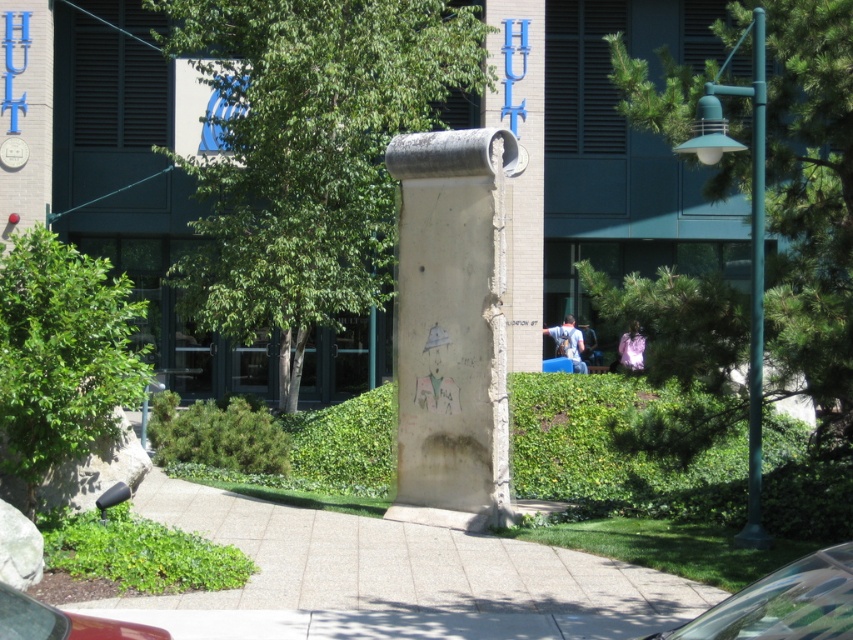
Which is above, metallic silver car at lower right or shiny red car at lower left?

metallic silver car at lower right

Is metallic silver car at lower right smaller than shiny red car at lower left?

No.

Is point (769, 605) positioned before point (82, 616)?

Yes, it is in front of point (82, 616).

Find the location of a particular element. This screenshot has height=640, width=853. metallic silver car at lower right is located at coordinates (782, 604).

Is point (318, 314) behind point (419, 224)?

Yes, it is behind point (419, 224).

Between green leafy tree at center and white concrete pillar at center, which one is positioned higher?

Positioned higher is green leafy tree at center.

What are the coordinates of `green leafy tree at center` in the screenshot? It's located at (308, 152).

You are a GUI agent. You are given a task and a screenshot of the screen. Output one action in this format:
    pyautogui.click(x=<x>, y=<y>)
    Task: Click on the green leafy tree at center
    The width and height of the screenshot is (853, 640).
    Given the screenshot: What is the action you would take?
    pyautogui.click(x=308, y=152)

Does green leafy tree at center come behind concrete at center?

Yes.

Is green leafy tree at center thinner than concrete at center?

Yes.

Is point (221, 1) closer to camera compared to point (364, 556)?

No, (221, 1) is behind (364, 556).

Where is `green leafy tree at center`? green leafy tree at center is located at coordinates (308, 152).